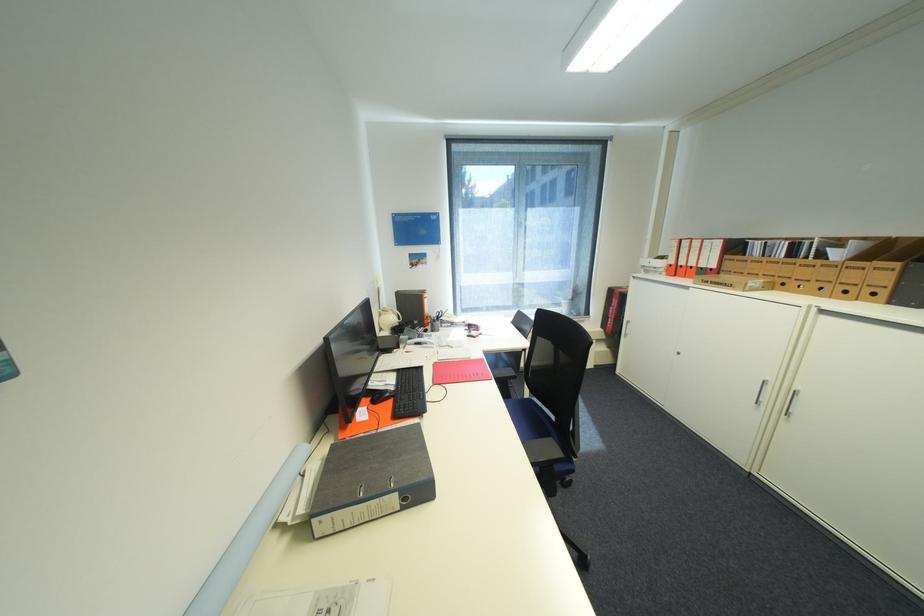
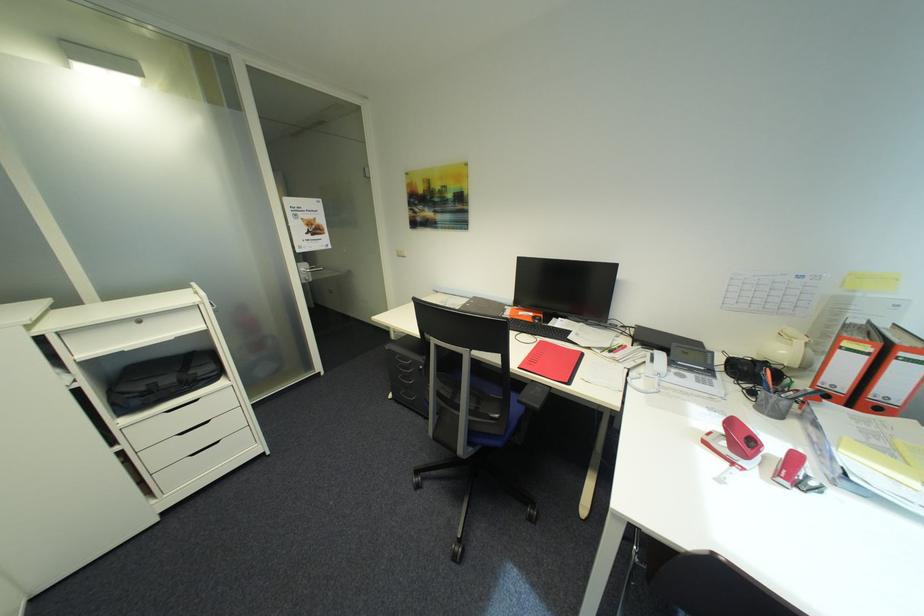
In the second image, find the point that corresponds to (x=489, y=334) in the first image.

(742, 464)